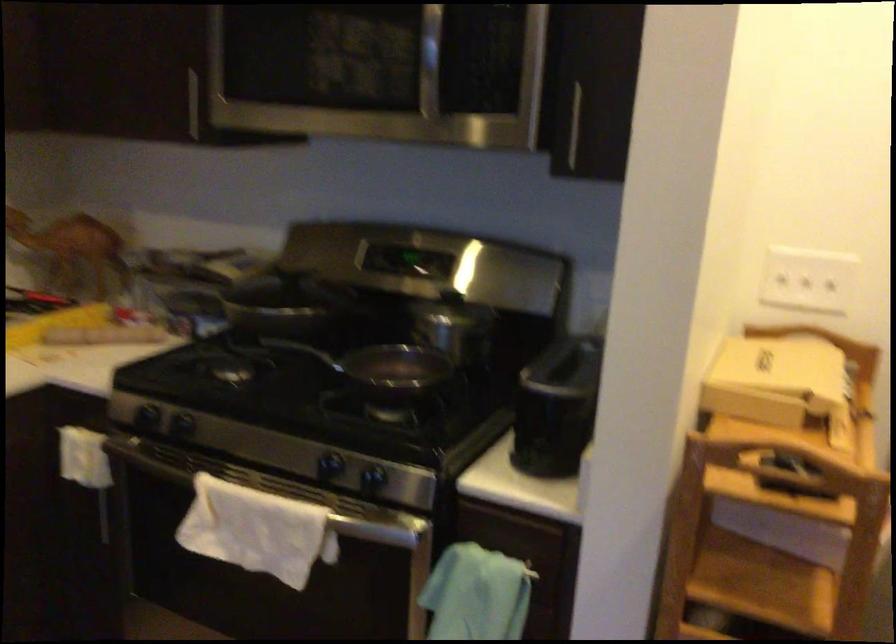
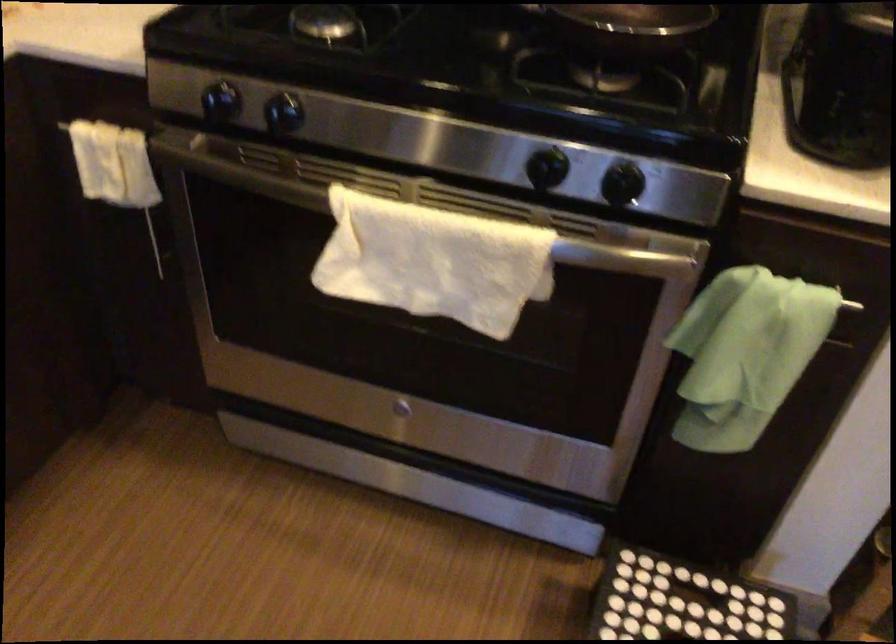
Locate, in the second image, the point that corresponds to (376,529) in the first image.

(618, 257)